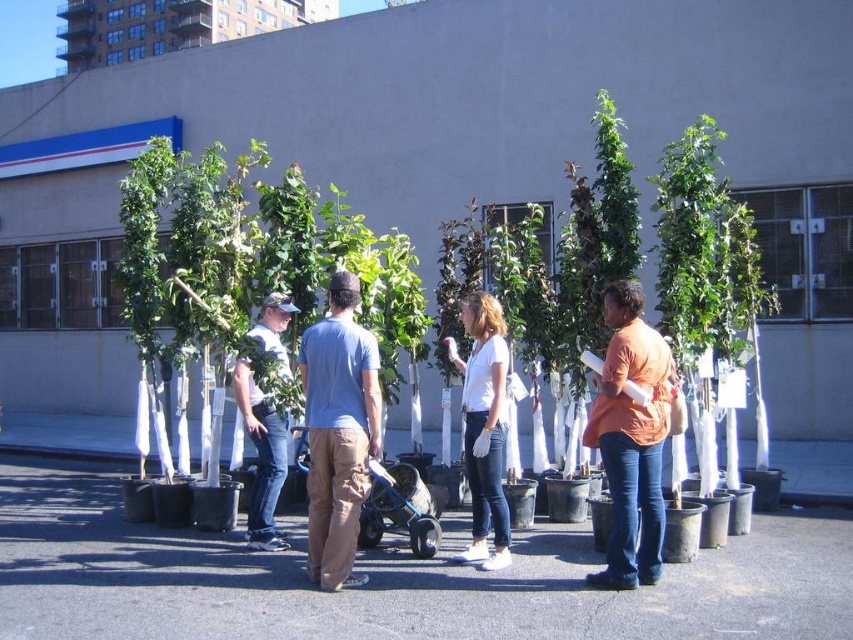
Does blue cotton shirt at center have a greater width compared to orange cotton shirt at center?

No, blue cotton shirt at center is not wider than orange cotton shirt at center.

Which is in front, point (339, 582) or point (610, 396)?

Point (610, 396) is in front.

Image resolution: width=853 pixels, height=640 pixels. What are the coordinates of `blue cotton shirt at center` in the screenshot? It's located at (338, 432).

Between point (345, 550) and point (276, 464), which one is positioned in front?

Positioned in front is point (345, 550).

The image size is (853, 640). In order to click on blue cotton shirt at center in this screenshot , I will do `click(338, 432)`.

At what (x,y) coordinates should I click in order to perform the action: click on blue cotton shirt at center. Please return your answer as a coordinate pair (x, y). The height and width of the screenshot is (640, 853). Looking at the image, I should click on (338, 432).

Describe the element at coordinates (631, 438) in the screenshot. The width and height of the screenshot is (853, 640). I see `orange cotton shirt at center` at that location.

Is orange cotton shirt at center to the left of white cotton shirt at center from the viewer's perspective?

In fact, orange cotton shirt at center is to the right of white cotton shirt at center.

Between point (630, 355) and point (253, 380), which one is positioned behind?

The point (253, 380) is more distant.

Find the location of `orange cotton shirt at center`. orange cotton shirt at center is located at coordinates [631, 438].